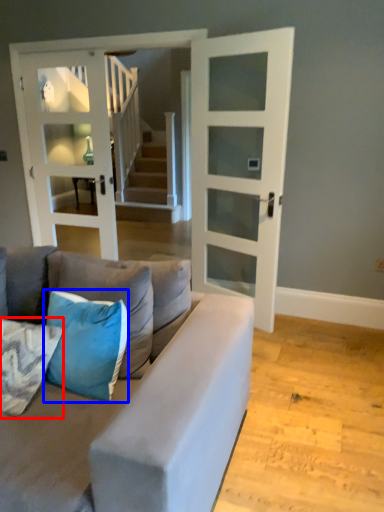
Question: Which object appears farthest to the camera in this image, pillow (highlighted by a red box) or pillow (highlighted by a blue box)?

Choices:
 (A) pillow
 (B) pillow

Answer: (B)